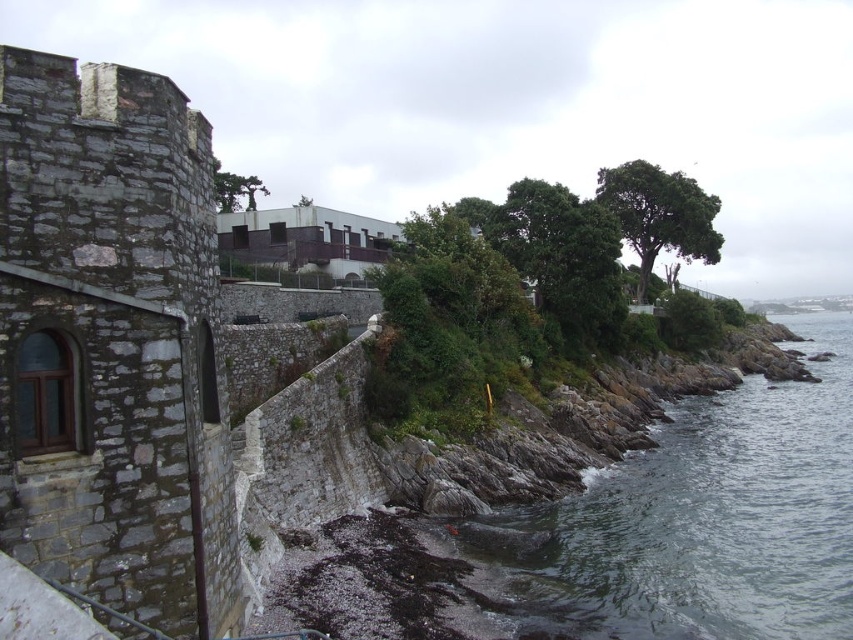
You are standing on the stone wall and want to look at the clear water at lower right and the green leafy tree at upper right. Which one do you see first when looking down from the wall?

The clear water at lower right is smaller in size compared to the green leafy tree at upper right, so you will see the green leafy tree at upper right first because it is larger and more prominent.

You are standing in front of the stone wall and looking towards the upper part of the image. Which tree, the green leafy tree at upper right or the green matte tree at upper center, is positioned more to the right side?

The green leafy tree at upper right is positioned more to the right side than the green matte tree at upper center.